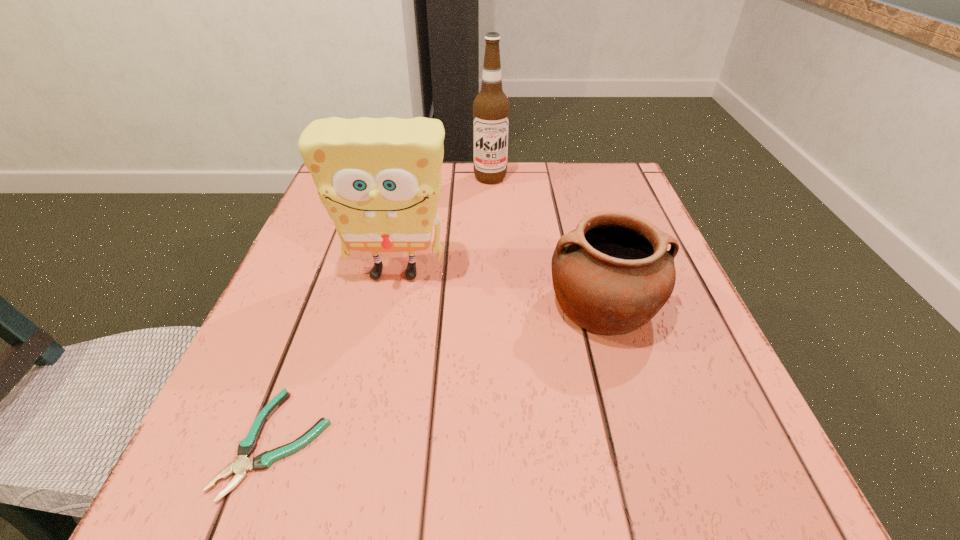
Identify the location of vacant space located on the back of the pliers. (342, 262).

Locate an element on the screen. This screenshot has height=540, width=960. object positioned at the far edge is located at coordinates (491, 107).

This screenshot has height=540, width=960. What are the coordinates of `object located at the near edge` in the screenshot? It's located at (242, 465).

Locate an element on the screen. The image size is (960, 540). sponge that is at the left edge is located at coordinates tap(379, 179).

Where is `pliers that is at the left edge`? This screenshot has width=960, height=540. pliers that is at the left edge is located at coordinates (242, 465).

You are a GUI agent. You are given a task and a screenshot of the screen. Output one action in this format:
    pyautogui.click(x=<x>, y=<y>)
    Task: Click on the object present at the right edge
    The image size is (960, 540).
    Given the screenshot: What is the action you would take?
    pyautogui.click(x=611, y=275)

The image size is (960, 540). Find the location of `object that is at the near left corner`. object that is at the near left corner is located at coordinates (242, 465).

Identify the location of vacant area at the far edge of the desktop. (542, 185).

Identify the location of vacant space at the near edge. The height and width of the screenshot is (540, 960). (346, 497).

In the image, there is a desktop. Where is `vacant space at the left edge`? vacant space at the left edge is located at coordinates (316, 298).